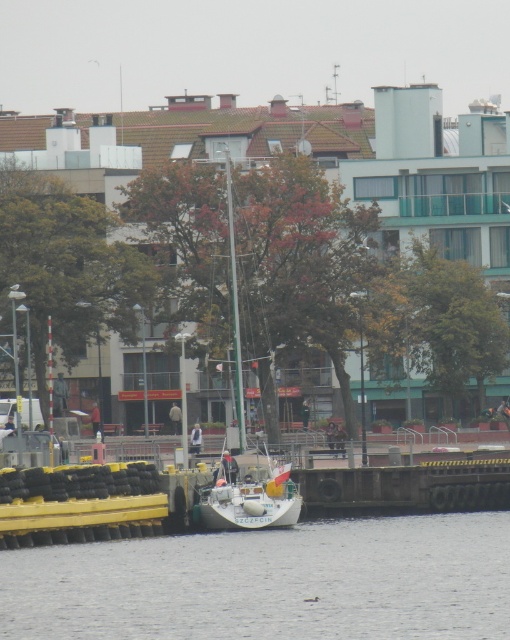
Is clear water at lower center above white matte sailboat at center?

Incorrect, clear water at lower center is not positioned above white matte sailboat at center.

Which is more to the left, clear water at lower center or white matte sailboat at center?

Positioned to the left is white matte sailboat at center.

Is point (443, 572) closer to camera compared to point (227, 209)?

Yes, it is.

Locate an element on the screen. This screenshot has width=510, height=640. clear water at lower center is located at coordinates (270, 582).